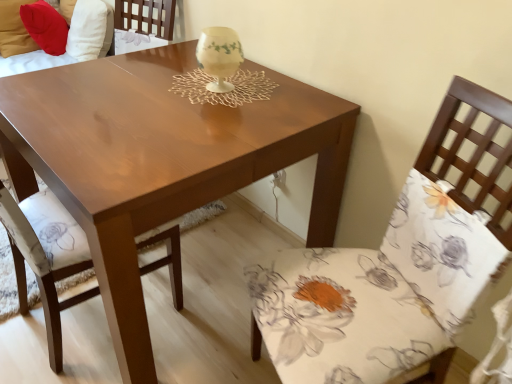
Question: Is ivory porcelain candle holder at center looking in the opposite direction of velvet red pillow at upper left, positioned as the 1th couch in right-to-left order?

Choices:
 (A) yes
 (B) no

Answer: (B)

Question: From the image's perspective, is ivory porcelain candle holder at center beneath velvet red pillow at upper left, positioned as the 1th couch in right-to-left order?

Choices:
 (A) no
 (B) yes

Answer: (B)

Question: Is the position of ivory porcelain candle holder at center less distant than that of velvet red pillow at upper left, marked as the second couch in a left-to-right arrangement?

Choices:
 (A) no
 (B) yes

Answer: (B)

Question: Is ivory porcelain candle holder at center with velvet red pillow at upper left, marked as the second couch in a left-to-right arrangement?

Choices:
 (A) no
 (B) yes

Answer: (A)

Question: Does ivory porcelain candle holder at center turn towards velvet red pillow at upper left, positioned as the 1th couch in right-to-left order?

Choices:
 (A) no
 (B) yes

Answer: (A)

Question: From a real-world perspective, is shiny brown table at center positioned above or below floral fabric chair at right, the 1th chair from the right?

Choices:
 (A) below
 (B) above

Answer: (A)

Question: From the image's perspective, is shiny brown table at center positioned above or below floral fabric chair at right, which is the second chair in left-to-right order?

Choices:
 (A) above
 (B) below

Answer: (A)

Question: Do you think shiny brown table at center is within floral fabric chair at right, which is the second chair in left-to-right order, or outside of it?

Choices:
 (A) inside
 (B) outside

Answer: (B)

Question: Does point (179, 210) appear closer or farther from the camera than point (437, 200)?

Choices:
 (A) farther
 (B) closer

Answer: (B)

Question: From their relative heights in the image, would you say ivory porcelain candle holder at center is taller or shorter than floral fabric chair at right, which is the second chair in left-to-right order?

Choices:
 (A) tall
 (B) short

Answer: (B)

Question: Is ivory porcelain candle holder at center spatially inside floral fabric chair at right, which is the second chair in left-to-right order, or outside of it?

Choices:
 (A) inside
 (B) outside

Answer: (B)

Question: Considering their positions, is ivory porcelain candle holder at center located in front of or behind floral fabric chair at right, which is the second chair in left-to-right order?

Choices:
 (A) behind
 (B) front

Answer: (A)

Question: Is ivory porcelain candle holder at center to the left or to the right of floral fabric chair at right, the 1th chair from the right, in the image?

Choices:
 (A) left
 (B) right

Answer: (A)

Question: Is matte brown couch at upper left, which appears as the 2th couch when viewed from the right, taller or shorter than floral fabric chair at right, which is the second chair in left-to-right order?

Choices:
 (A) tall
 (B) short

Answer: (B)

Question: In the image, is matte brown couch at upper left, positioned as the 1th couch in left-to-right order, positioned in front of or behind floral fabric chair at right, the 1th chair from the right?

Choices:
 (A) front
 (B) behind

Answer: (B)